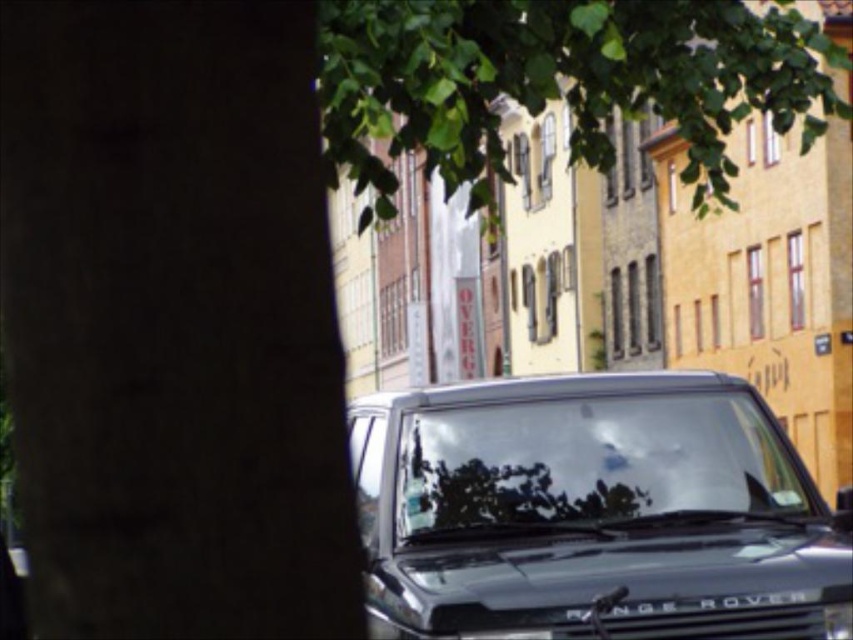
Question: Can you confirm if shiny black range rover at center is thinner than green leafy tree at upper center?

Choices:
 (A) no
 (B) yes

Answer: (B)

Question: Is shiny black range rover at center smaller than green leafy tree at upper center?

Choices:
 (A) yes
 (B) no

Answer: (A)

Question: Is shiny black range rover at center to the right of green leafy tree at upper center from the viewer's perspective?

Choices:
 (A) yes
 (B) no

Answer: (B)

Question: Which point appears closest to the camera in this image?

Choices:
 (A) pyautogui.click(x=831, y=83)
 (B) pyautogui.click(x=519, y=509)

Answer: (B)

Question: Among these objects, which one is farthest from the camera?

Choices:
 (A) green leafy tree at upper center
 (B) shiny black range rover at center

Answer: (B)